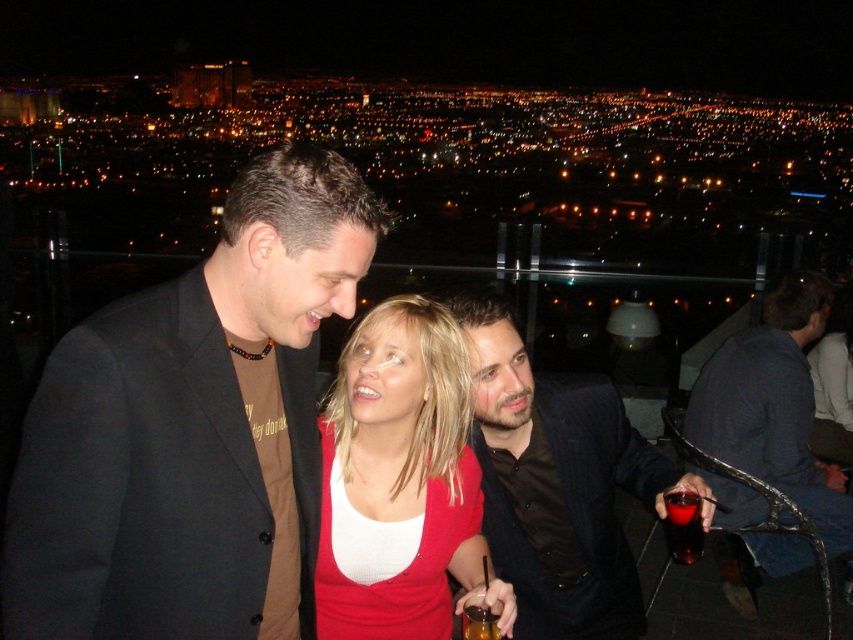
You are a photographer at the rooftop bar and want to capture a shot of the shiny black suit at center and the translucent plastic cup at lower right. To ensure both are in frame, should you adjust your camera to focus on the left side or the right side of the scene?

The shiny black suit at center is to the left of the translucent plastic cup at lower right, so you should focus on the left side to include both in the frame.

You are a bartender at the rooftop bar and need to pour the translucent amber liquid at lower center into the translucent plastic cup at lower right. Can the cup hold the liquid without spilling?

The translucent plastic cup at lower right has a larger size compared to the translucent amber liquid at lower center, so yes, the cup can hold the liquid without spilling.

You are standing at the point with coordinates point [575,420]. You want to move to the point with coordinates point [699,506]. Is the point you want to reach in front of or behind you?

The point you want to reach, point [699,506], is in front of you because point [575,420] is behind point [699,506].